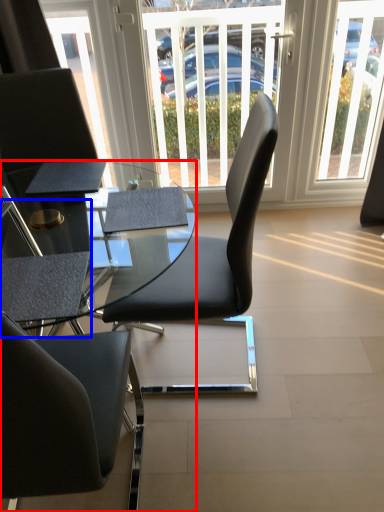
Question: Which object appears closest to the camera in this image, desk (highlighted by a red box) or armchair (highlighted by a blue box)?

Choices:
 (A) desk
 (B) armchair

Answer: (A)